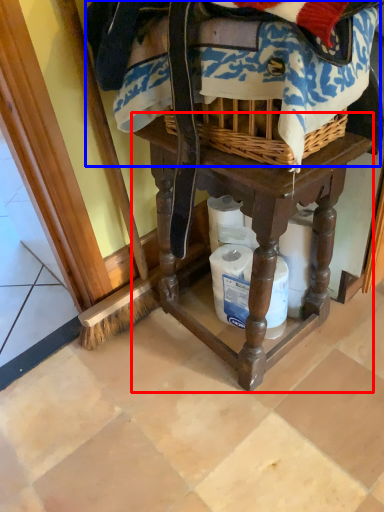
Question: Which point is further to the camera, furniture (highlighted by a red box) or clothing (highlighted by a blue box)?

Choices:
 (A) furniture
 (B) clothing

Answer: (A)